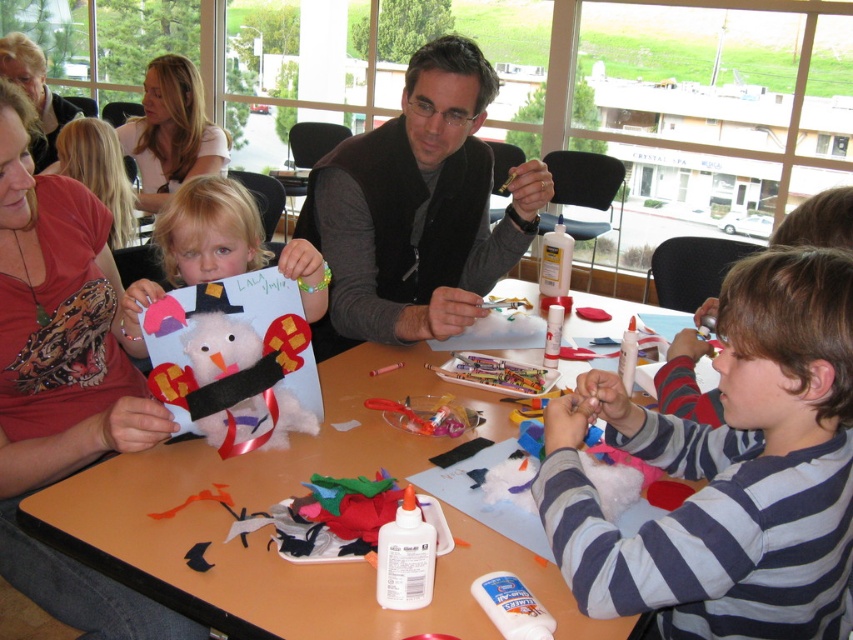
From the picture: Which of these two, striped cotton shirt at center or fuzzy felt snowman at center, stands taller?

striped cotton shirt at center

Who is shorter, striped cotton shirt at center or fuzzy felt snowman at center?

fuzzy felt snowman at center is shorter.

Who is more distant from viewer, (x=563, y=488) or (x=296, y=378)?

The point (x=296, y=378) is more distant.

Where is `striped cotton shirt at center`? striped cotton shirt at center is located at coordinates coord(728,472).

Who is positioned more to the right, matte white paper at center or fuzzy white snowman at center?

matte white paper at center is more to the right.

Image resolution: width=853 pixels, height=640 pixels. Describe the element at coordinates (289, 496) in the screenshot. I see `matte white paper at center` at that location.

Identify the location of matte white paper at center. The width and height of the screenshot is (853, 640). (289, 496).

Which is below, black vest at center or light pink fabric shirt at upper left?

Positioned lower is black vest at center.

Who is positioned more to the left, black vest at center or light pink fabric shirt at upper left?

light pink fabric shirt at upper left

Where is `black vest at center`? The height and width of the screenshot is (640, 853). black vest at center is located at coordinates (419, 205).

In order to click on black vest at center in this screenshot , I will do `click(419, 205)`.